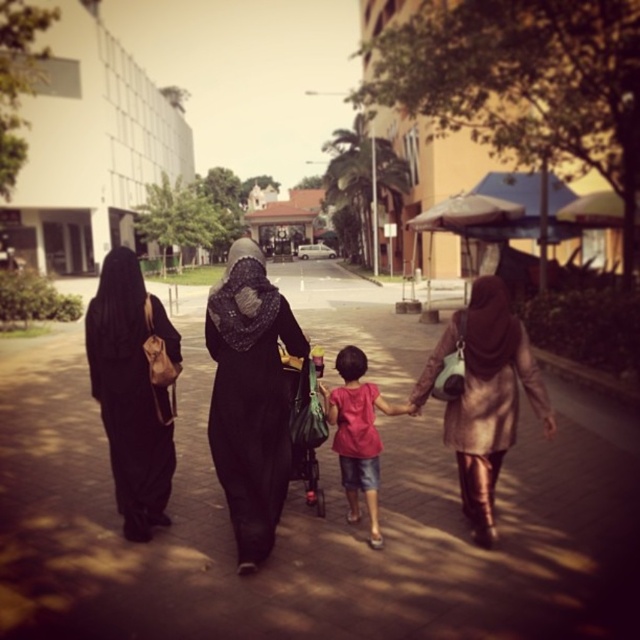
You are a photographer trying to capture a candid shot of the group. You want to ensure that both the black matte hijab at left and the pink fabric shirt at center are visible in your frame. Based on their positions, which object should you focus on first to include both in the shot?

The black matte hijab at left is located above the pink fabric shirt at center, so focusing on the black matte hijab at left first will ensure both are within the frame.

You are a photographer trying to capture the pink fabric shirt at center without the black matte hijab at center blocking it. What adjustment should you make to your camera angle?

The black matte hijab at center is positioned over the pink fabric shirt at center, so to avoid the hijab blocking the shirt, you should lower your camera angle to shoot from below the hijab.